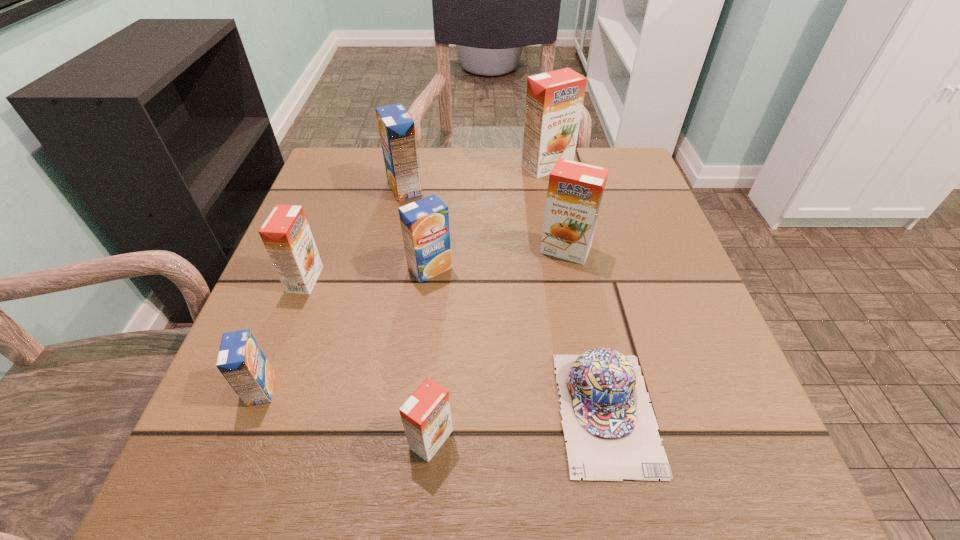
In order to click on the second nearest orange_juice in this screenshot , I will do `click(241, 361)`.

Where is `the shortest object`? the shortest object is located at coordinates (611, 431).

You are a GUI agent. You are given a task and a screenshot of the screen. Output one action in this format:
    pyautogui.click(x=<x>, y=<y>)
    Task: Click on the free space located 0.140m on the right of the tallest orange_juice
    
    Given the screenshot: What is the action you would take?
    [x=630, y=166]

Locate an element on the screen. The height and width of the screenshot is (540, 960). free space located on the front of the farthest blue orange_juice is located at coordinates (390, 261).

You are a GUI agent. You are given a task and a screenshot of the screen. Output one action in this format:
    pyautogui.click(x=<x>, y=<y>)
    Task: Click on the free location located on the left of the third nearest orange orange juice
    The width and height of the screenshot is (960, 540).
    Given the screenshot: What is the action you would take?
    pos(514,250)

Where is `vacant region located 0.260m on the right of the second nearest blue orange_juice`? vacant region located 0.260m on the right of the second nearest blue orange_juice is located at coordinates (589, 268).

Where is `free location located 0.240m on the back of the second smallest orange orange juice`? The height and width of the screenshot is (540, 960). free location located 0.240m on the back of the second smallest orange orange juice is located at coordinates (339, 192).

Locate an element on the screen. Image resolution: width=960 pixels, height=540 pixels. blank space located on the right of the second orange orange juice from left to right is located at coordinates (598, 440).

Find the location of a particular element. The height and width of the screenshot is (540, 960). vacant space located on the right of the leftmost blue orange_juice is located at coordinates (483, 389).

Identify the location of orange juice at the near edge. Image resolution: width=960 pixels, height=540 pixels. coord(426,416).